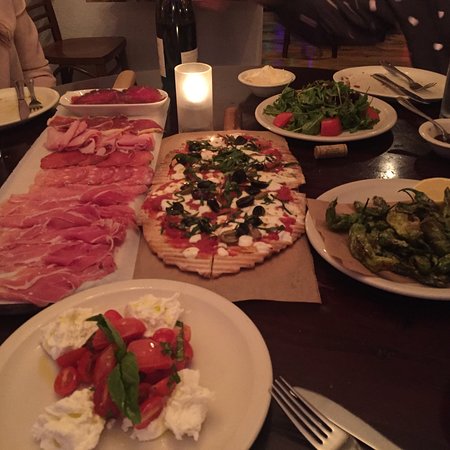
Identify the location of chairs. (284, 47), (100, 54).